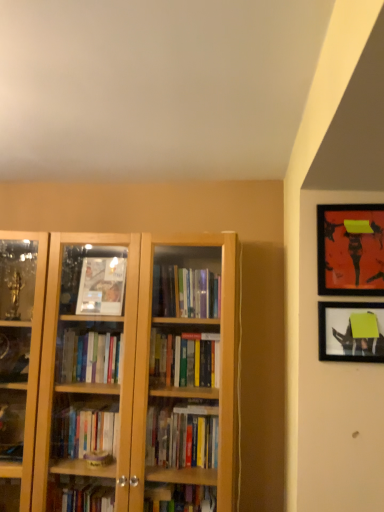
What are the coordinates of `matte black picture frame at upper right, the first picture frame positioned from the bottom` in the screenshot? It's located at (351, 331).

This screenshot has height=512, width=384. Describe the element at coordinates (351, 331) in the screenshot. I see `matte black picture frame at upper right, the 2th picture frame positioned from the top` at that location.

What is the approximate width of matte black picture frame at upper right, the 2th picture frame positioned from the top?

The width of matte black picture frame at upper right, the 2th picture frame positioned from the top, is 1.46 inches.

In order to click on matte black picture frame at upper right, which is the second picture frame from bottom to top in this screenshot , I will do `click(350, 249)`.

Image resolution: width=384 pixels, height=512 pixels. Describe the element at coordinates (350, 249) in the screenshot. I see `matte black picture frame at upper right, the 1th picture frame positioned from the top` at that location.

The height and width of the screenshot is (512, 384). I want to click on matte black picture frame at upper right, the 2th picture frame positioned from the top, so (x=351, y=331).

In the scene shown: Considering the relative positions of matte black picture frame at upper right, the first picture frame positioned from the bottom, and matte black picture frame at upper right, which is the second picture frame from bottom to top, in the image provided, is matte black picture frame at upper right, the first picture frame positioned from the bottom, to the right of matte black picture frame at upper right, which is the second picture frame from bottom to top, from the viewer's perspective?

In fact, matte black picture frame at upper right, the first picture frame positioned from the bottom, is to the left of matte black picture frame at upper right, which is the second picture frame from bottom to top.

Between matte black picture frame at upper right, the 2th picture frame positioned from the top, and matte black picture frame at upper right, the 1th picture frame positioned from the top, which one is positioned behind?

Positioned behind is matte black picture frame at upper right, the 2th picture frame positioned from the top.

Does point (339, 338) appear closer or farther from the camera than point (372, 214)?

Point (339, 338) is closer to the camera than point (372, 214).

From the image's perspective, is matte black picture frame at upper right, the 2th picture frame positioned from the top, over matte black picture frame at upper right, the 1th picture frame positioned from the top?

No.

From a real-world perspective, which is physically above, matte black picture frame at upper right, the first picture frame positioned from the bottom, or matte black picture frame at upper right, which is the second picture frame from bottom to top?

In real-world perspective, matte black picture frame at upper right, which is the second picture frame from bottom to top, is above.

Between matte black picture frame at upper right, the 2th picture frame positioned from the top, and matte black picture frame at upper right, which is the second picture frame from bottom to top, which one has smaller width?

matte black picture frame at upper right, the 2th picture frame positioned from the top, is thinner.

From their relative heights in the image, would you say matte black picture frame at upper right, the first picture frame positioned from the bottom, is taller or shorter than matte black picture frame at upper right, which is the second picture frame from bottom to top?

matte black picture frame at upper right, the first picture frame positioned from the bottom, is shorter than matte black picture frame at upper right, which is the second picture frame from bottom to top.

Considering the sizes of objects matte black picture frame at upper right, the first picture frame positioned from the bottom, and matte black picture frame at upper right, the 1th picture frame positioned from the top, in the image provided, who is bigger, matte black picture frame at upper right, the first picture frame positioned from the bottom, or matte black picture frame at upper right, the 1th picture frame positioned from the top,?

matte black picture frame at upper right, the 1th picture frame positioned from the top.

Is matte black picture frame at upper right, the 2th picture frame positioned from the top, not within matte black picture frame at upper right, which is the second picture frame from bottom to top?

Absolutely, matte black picture frame at upper right, the 2th picture frame positioned from the top, is external to matte black picture frame at upper right, which is the second picture frame from bottom to top.

Is there a large distance between matte black picture frame at upper right, the 2th picture frame positioned from the top, and matte black picture frame at upper right, the 1th picture frame positioned from the top?

matte black picture frame at upper right, the 2th picture frame positioned from the top, is near matte black picture frame at upper right, the 1th picture frame positioned from the top, not far away.

From the picture: Is matte black picture frame at upper right, the first picture frame positioned from the bottom, turned away from matte black picture frame at upper right, which is the second picture frame from bottom to top?

matte black picture frame at upper right, the first picture frame positioned from the bottom, is not turned away from matte black picture frame at upper right, which is the second picture frame from bottom to top.

How different are the orientations of matte black picture frame at upper right, the 2th picture frame positioned from the top, and matte black picture frame at upper right, which is the second picture frame from bottom to top, in degrees?

The facing directions of matte black picture frame at upper right, the 2th picture frame positioned from the top, and matte black picture frame at upper right, which is the second picture frame from bottom to top, are 0.0352 degrees apart.

The width and height of the screenshot is (384, 512). Find the location of `picture frame lying above the matte black picture frame at upper right, the first picture frame positioned from the bottom (from the image's perspective)`. picture frame lying above the matte black picture frame at upper right, the first picture frame positioned from the bottom (from the image's perspective) is located at coordinates (350, 249).

Considering the relative positions of matte black picture frame at upper right, the 1th picture frame positioned from the top, and matte black picture frame at upper right, the first picture frame positioned from the bottom, in the image provided, is matte black picture frame at upper right, the 1th picture frame positioned from the top, to the left of matte black picture frame at upper right, the first picture frame positioned from the bottom, from the viewer's perspective?

Incorrect, matte black picture frame at upper right, the 1th picture frame positioned from the top, is not on the left side of matte black picture frame at upper right, the first picture frame positioned from the bottom.

Is matte black picture frame at upper right, which is the second picture frame from bottom to top, closer to the viewer compared to matte black picture frame at upper right, the 2th picture frame positioned from the top?

Yes, the depth of matte black picture frame at upper right, which is the second picture frame from bottom to top, is less than that of matte black picture frame at upper right, the 2th picture frame positioned from the top.

Is point (375, 208) closer or farther from the camera than point (375, 343)?

Clearly, point (375, 208) is more distant from the camera than point (375, 343).

From the image's perspective, who appears lower, matte black picture frame at upper right, the 1th picture frame positioned from the top, or matte black picture frame at upper right, the 2th picture frame positioned from the top?

matte black picture frame at upper right, the 2th picture frame positioned from the top.

From a real-world perspective, who is located lower, matte black picture frame at upper right, the 1th picture frame positioned from the top, or matte black picture frame at upper right, the first picture frame positioned from the bottom?

matte black picture frame at upper right, the first picture frame positioned from the bottom.

Looking at their sizes, would you say matte black picture frame at upper right, the 1th picture frame positioned from the top, is wider or thinner than matte black picture frame at upper right, the first picture frame positioned from the bottom?

Considering their sizes, matte black picture frame at upper right, the 1th picture frame positioned from the top, looks broader than matte black picture frame at upper right, the first picture frame positioned from the bottom.

Between matte black picture frame at upper right, the 1th picture frame positioned from the top, and matte black picture frame at upper right, the 2th picture frame positioned from the top, which one has less height?

With less height is matte black picture frame at upper right, the 2th picture frame positioned from the top.

Considering the sizes of matte black picture frame at upper right, the 1th picture frame positioned from the top, and matte black picture frame at upper right, the first picture frame positioned from the bottom, in the image, is matte black picture frame at upper right, the 1th picture frame positioned from the top, bigger or smaller than matte black picture frame at upper right, the first picture frame positioned from the bottom,?

Considering their sizes, matte black picture frame at upper right, the 1th picture frame positioned from the top, takes up more space than matte black picture frame at upper right, the first picture frame positioned from the bottom.

Is matte black picture frame at upper right, the 1th picture frame positioned from the top, completely or partially outside of matte black picture frame at upper right, the first picture frame positioned from the bottom?

That's correct, matte black picture frame at upper right, the 1th picture frame positioned from the top, is outside of matte black picture frame at upper right, the first picture frame positioned from the bottom.

Is matte black picture frame at upper right, the 1th picture frame positioned from the top, far from matte black picture frame at upper right, the first picture frame positioned from the bottom?

matte black picture frame at upper right, the 1th picture frame positioned from the top, is near matte black picture frame at upper right, the first picture frame positioned from the bottom, not far away.

Based on the photo, is matte black picture frame at upper right, the 1th picture frame positioned from the top, looking in the opposite direction of matte black picture frame at upper right, the first picture frame positioned from the bottom?

No, matte black picture frame at upper right, the first picture frame positioned from the bottom, is not at the back of matte black picture frame at upper right, the 1th picture frame positioned from the top.

I want to click on picture frame behind the matte black picture frame at upper right, the 1th picture frame positioned from the top, so click(351, 331).

What are the coordinates of `picture frame located in front of the matte black picture frame at upper right, the first picture frame positioned from the bottom` in the screenshot? It's located at (350, 249).

Locate an element on the screen. picture frame that is under the matte black picture frame at upper right, which is the second picture frame from bottom to top (from a real-world perspective) is located at coordinates (351, 331).